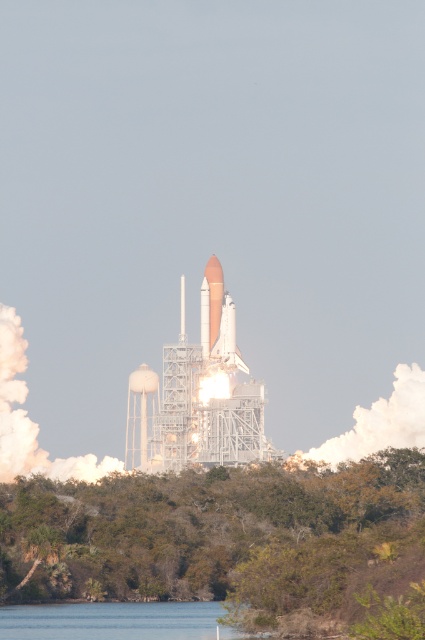
Does point (44, 604) come in front of point (204, 310)?

Yes.

Is the position of clear water at lower center less distant than that of white glossy shuttle at center?

Yes, clear water at lower center is in front of white glossy shuttle at center.

Is point (115, 611) in front of point (201, 310)?

Yes.

This screenshot has width=425, height=640. Identify the location of clear water at lower center. [x=110, y=620].

Based on the photo, between white glossy shuttle at center and matte white shuttle at center, which one is positioned higher?

Positioned higher is white glossy shuttle at center.

Is white glossy shuttle at center in front of matte white shuttle at center?

Yes, it is in front of matte white shuttle at center.

Between point (206, 296) and point (217, 358), which one is positioned in front?

Point (217, 358)

The height and width of the screenshot is (640, 425). In order to click on white glossy shuttle at center in this screenshot , I will do `click(210, 304)`.

Between clear water at lower center and matte white shuttle at center, which one is positioned lower?

Positioned lower is clear water at lower center.

Is clear water at lower center to the right of matte white shuttle at center from the viewer's perspective?

Incorrect, clear water at lower center is not on the right side of matte white shuttle at center.

Does point (141, 605) come in front of point (221, 337)?

That is True.

The height and width of the screenshot is (640, 425). Find the location of `clear water at lower center`. clear water at lower center is located at coordinates (110, 620).